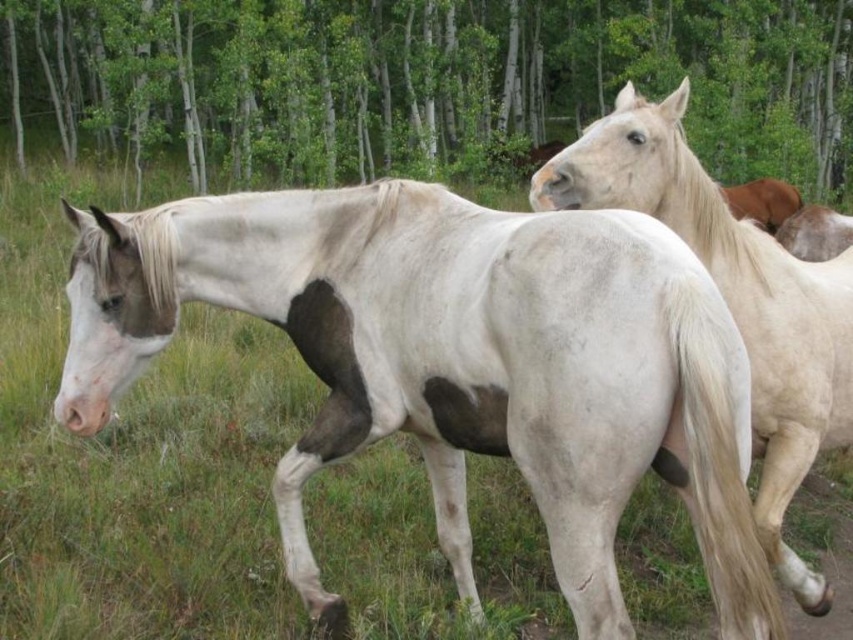
Between white matte horse at center and green leafy tree at center, which one has less height?

white matte horse at center is shorter.

Is point (500, 323) positioned in front of point (550, 106)?

Yes, point (500, 323) is closer to viewer.

Which is behind, point (399, 403) or point (299, 120)?

The point (299, 120) is more distant.

Identify the location of white matte horse at center. (456, 364).

Is white matte horse at upper right below brown glossy horse at upper right?

Correct, white matte horse at upper right is located below brown glossy horse at upper right.

Which is more to the right, white matte horse at upper right or brown glossy horse at upper right?

From the viewer's perspective, brown glossy horse at upper right appears more on the right side.

Image resolution: width=853 pixels, height=640 pixels. In order to click on white matte horse at upper right in this screenshot , I will do `click(732, 298)`.

Who is positioned more to the right, green leafy tree at center or brown glossy horse at upper right?

Positioned to the right is brown glossy horse at upper right.

Between green leafy tree at center and brown glossy horse at upper right, which one has more height?

green leafy tree at center is taller.

Where is `green leafy tree at center`? The image size is (853, 640). green leafy tree at center is located at coordinates (422, 83).